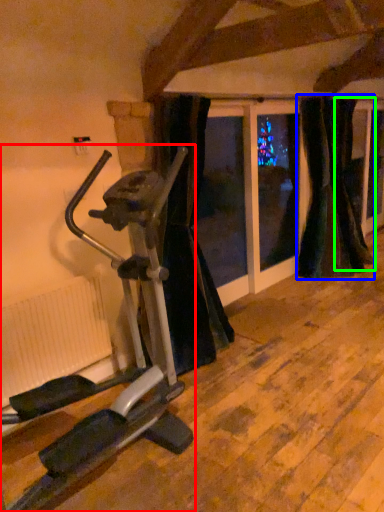
Question: Which is nearer to the stationary bicycle (highlighted by a red box)? curtain (highlighted by a blue box) or curtain (highlighted by a green box).

Choices:
 (A) curtain
 (B) curtain

Answer: (A)